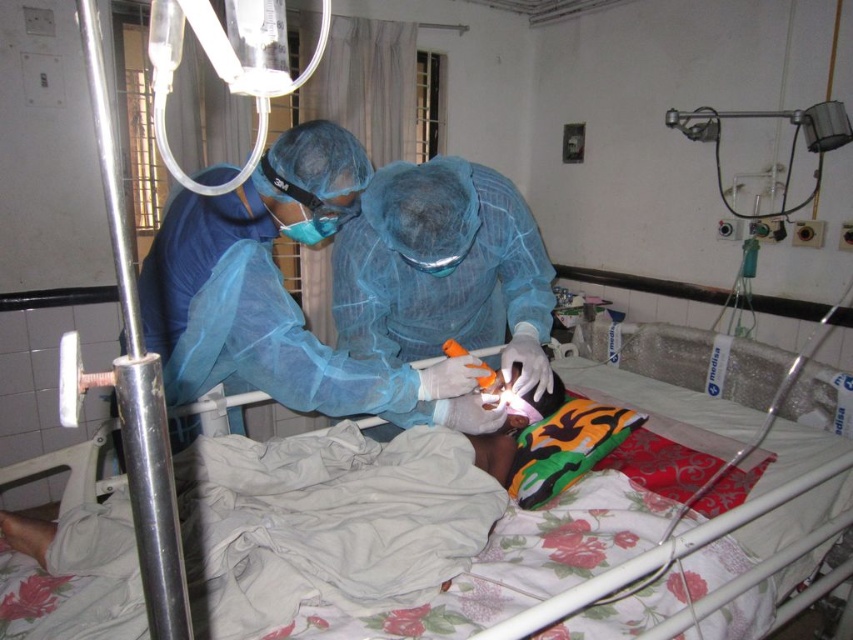
Is floral fabric hospital bed at center thinner than blue mesh gown at center?

No.

Does floral fabric hospital bed at center have a lesser height compared to blue mesh gown at center?

Yes.

This screenshot has width=853, height=640. I want to click on floral fabric hospital bed at center, so click(328, 524).

What are the coordinates of `floral fabric hospital bed at center` in the screenshot? It's located at (328, 524).